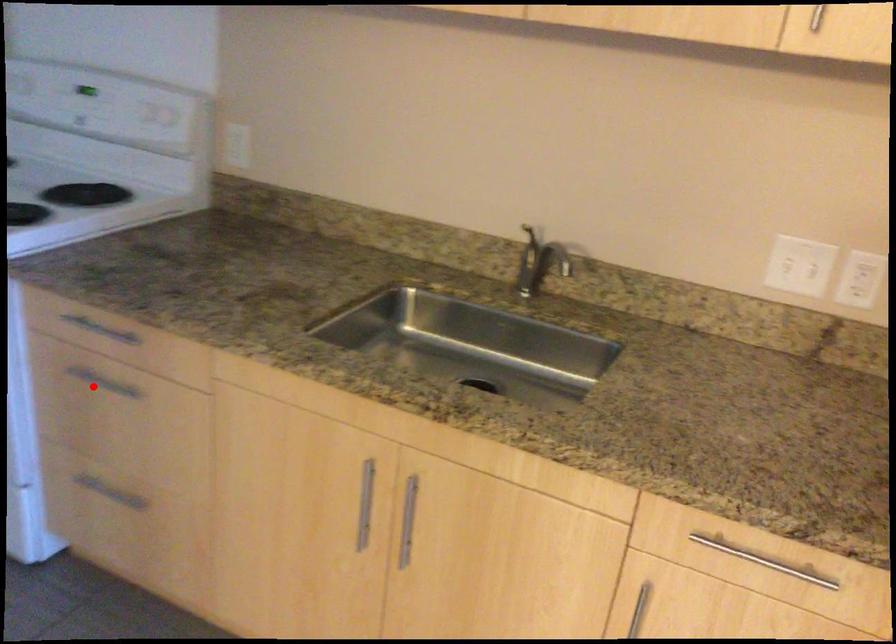
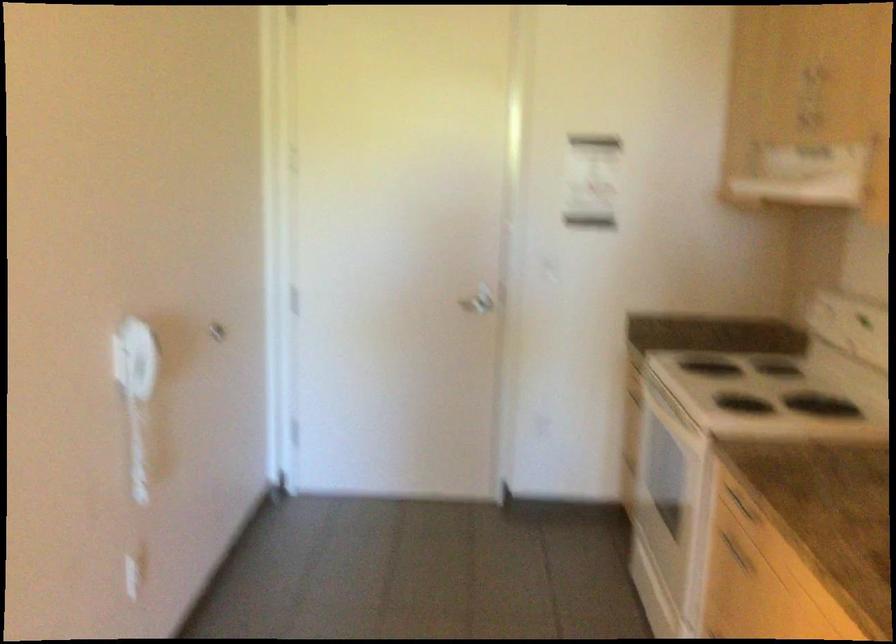
In the second image, find the point that corresponds to the highlighted location in the first image.

(735, 552)